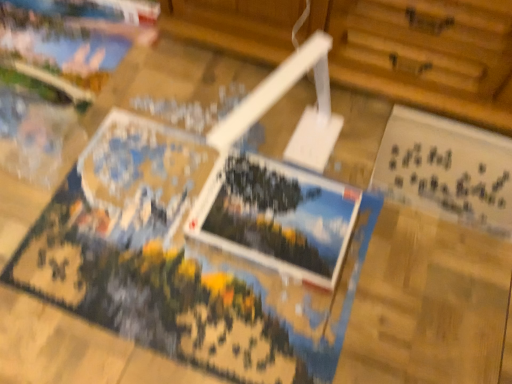
You are a GUI agent. You are given a task and a screenshot of the screen. Output one action in this format:
    pyautogui.click(x=<x>, y=<y>)
    Task: Click on the free location in front of printed paper postcard at center, positioned as the first postcard in left-to-right order
    Image resolution: width=512 pixels, height=384 pixels.
    Given the screenshot: What is the action you would take?
    pyautogui.click(x=263, y=320)